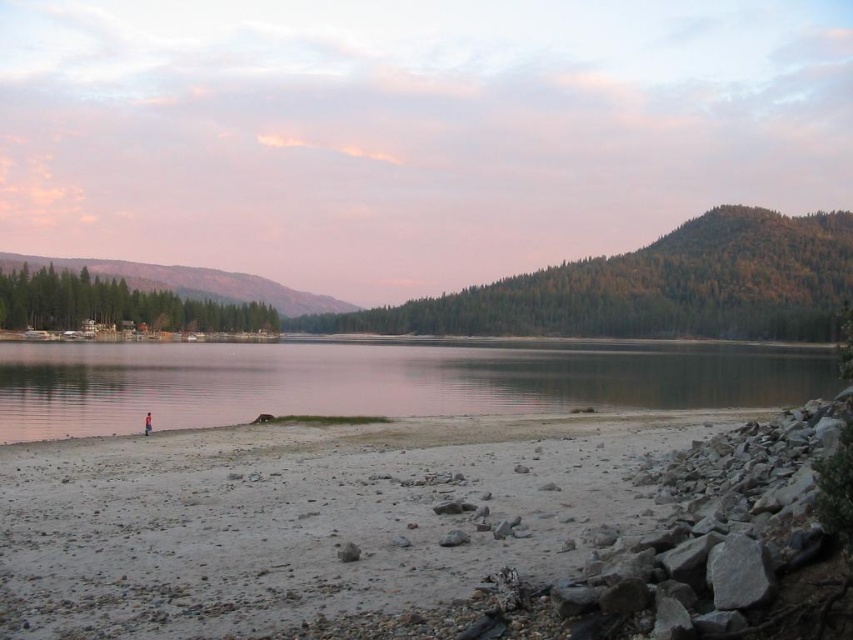
Where is `green forested mountain at center`? green forested mountain at center is located at coordinates (654, 288).

Does point (824, 291) come farther from viewer compared to point (271, 280)?

No, (824, 291) is closer to viewer.

The image size is (853, 640). I want to click on green forested mountain at center, so click(x=654, y=288).

Is smooth sand beach at lower left smaller than green forested mountain at center?

Indeed, smooth sand beach at lower left has a smaller size compared to green forested mountain at center.

Who is shorter, smooth sand beach at lower left or green forested mountain at center?

With less height is smooth sand beach at lower left.

Who is more distant from viewer, (454, 596) or (737, 212)?

The point (737, 212) is more distant.

I want to click on smooth sand beach at lower left, so click(x=306, y=516).

Is smooth sand beach at lower left above clear water at center?

Incorrect, smooth sand beach at lower left is not positioned above clear water at center.

What do you see at coordinates (306, 516) in the screenshot?
I see `smooth sand beach at lower left` at bounding box center [306, 516].

Does point (119, 529) come in front of point (753, 355)?

Yes.

Where is `smooth sand beach at lower left`? smooth sand beach at lower left is located at coordinates (306, 516).